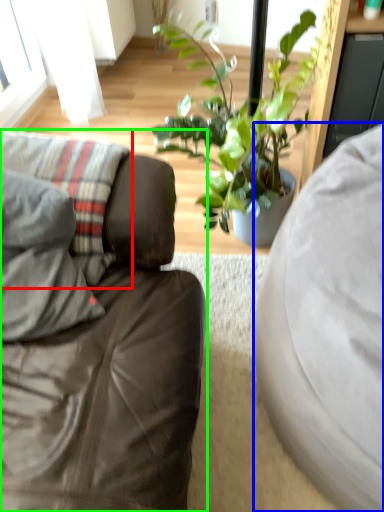
Question: Considering the real-world distances, which object is farthest from pillow (highlighted by a red box)? studio couch (highlighted by a blue box) or studio couch (highlighted by a green box)?

Choices:
 (A) studio couch
 (B) studio couch

Answer: (A)